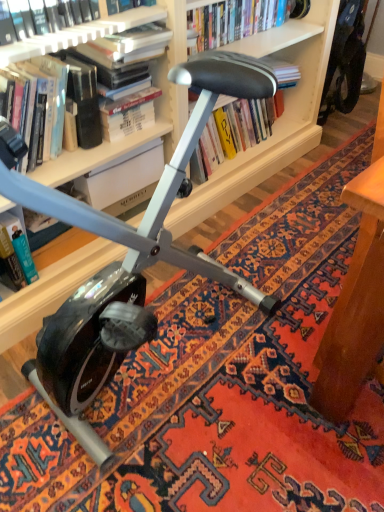
At what (x,y) coordinates should I click in order to perform the action: click on blank area beneath matte white bookcase at upper center (from a real-world perspective). Please return your answer as a coordinate pair (x, y). The height and width of the screenshot is (512, 384). Looking at the image, I should click on (151, 359).